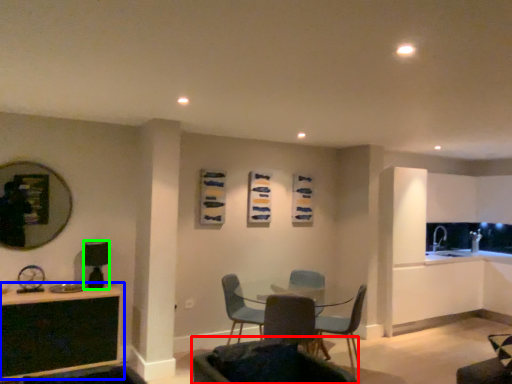
Question: Which is nearer to the chair (highlighted by a red box)? table (highlighted by a blue box) or appliance (highlighted by a green box).

Choices:
 (A) table
 (B) appliance

Answer: (A)